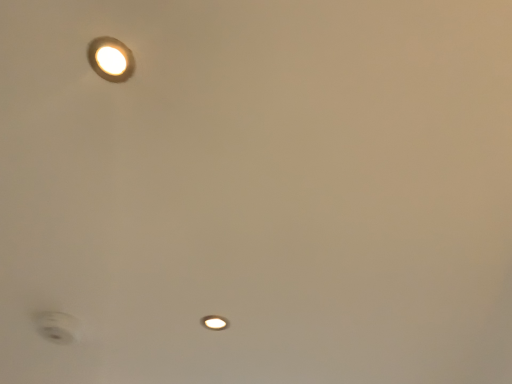
Locate an element on the screen. The height and width of the screenshot is (384, 512). matte white light fixture at upper left is located at coordinates pos(111,59).

What do you see at coordinates (111, 59) in the screenshot?
I see `matte white light fixture at upper left` at bounding box center [111, 59].

Image resolution: width=512 pixels, height=384 pixels. I want to click on matte white light fixture at upper left, so click(x=111, y=59).